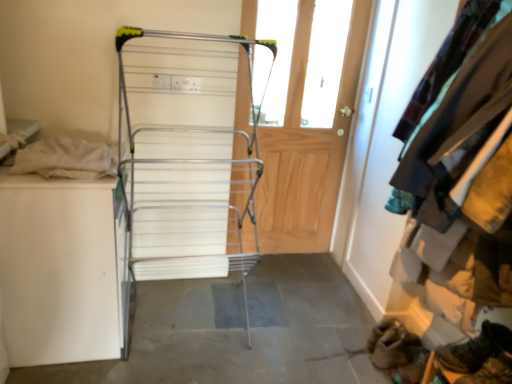
Where is `free location to the right of silver metallic drying rack at center`? This screenshot has width=512, height=384. free location to the right of silver metallic drying rack at center is located at coordinates (284, 332).